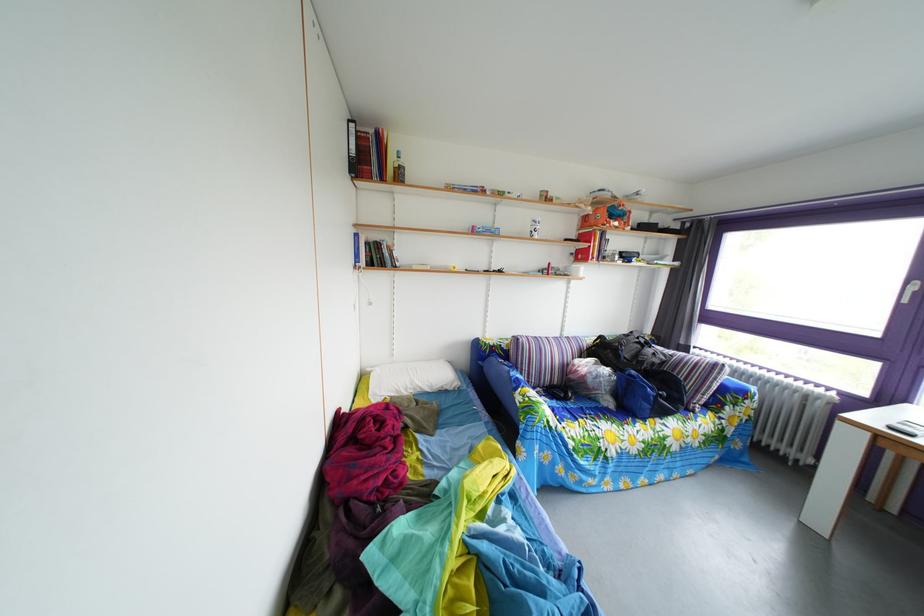
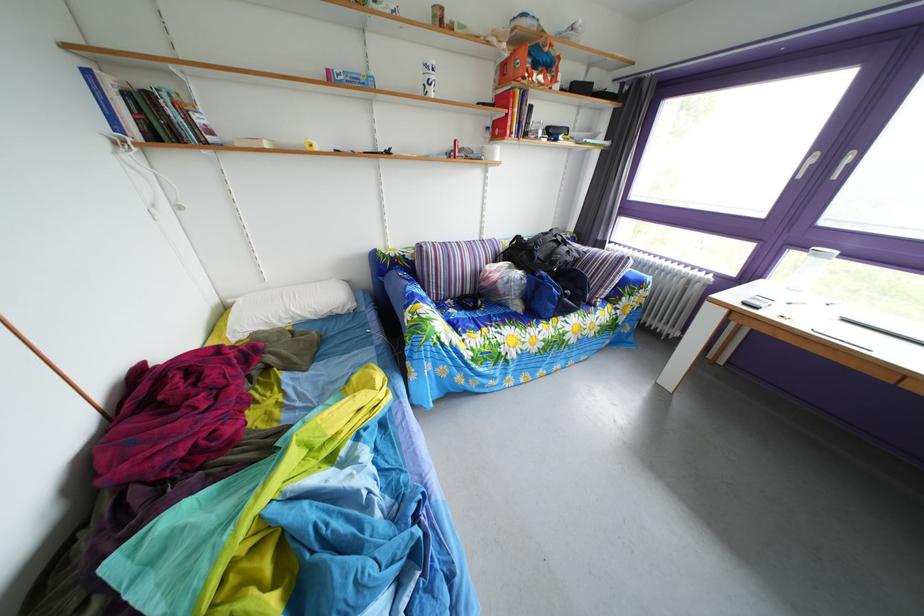
Locate, in the second image, the point that corresponds to point (422, 391) in the first image.

(298, 320)